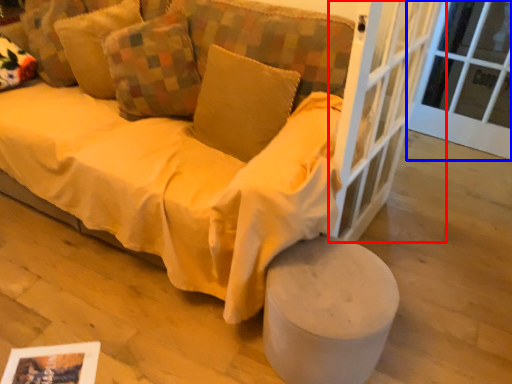
Question: Which point is closer to the camera, screen door (highlighted by a red box) or window frame (highlighted by a blue box)?

Choices:
 (A) screen door
 (B) window frame

Answer: (A)